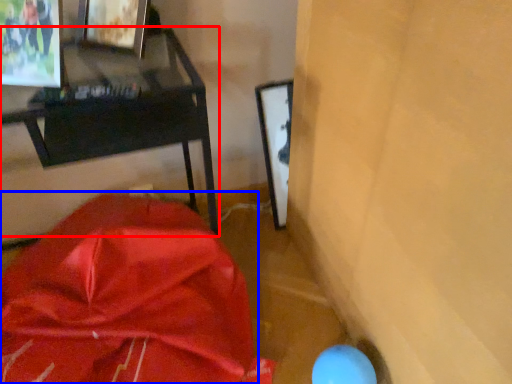
Question: Which point is further to the camera, furniture (highlighted by a red box) or wrap (highlighted by a blue box)?

Choices:
 (A) furniture
 (B) wrap

Answer: (A)